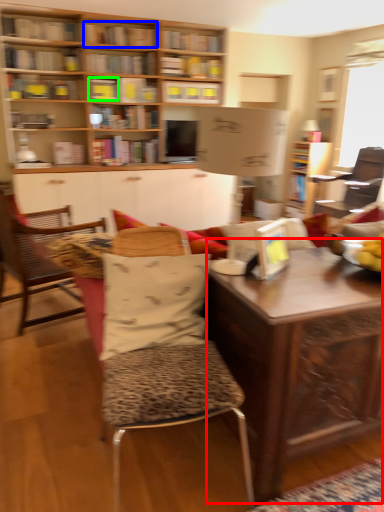
Question: Which is farther away from desk (highlighted by a red box)? book (highlighted by a blue box) or book (highlighted by a green box)?

Choices:
 (A) book
 (B) book

Answer: (A)